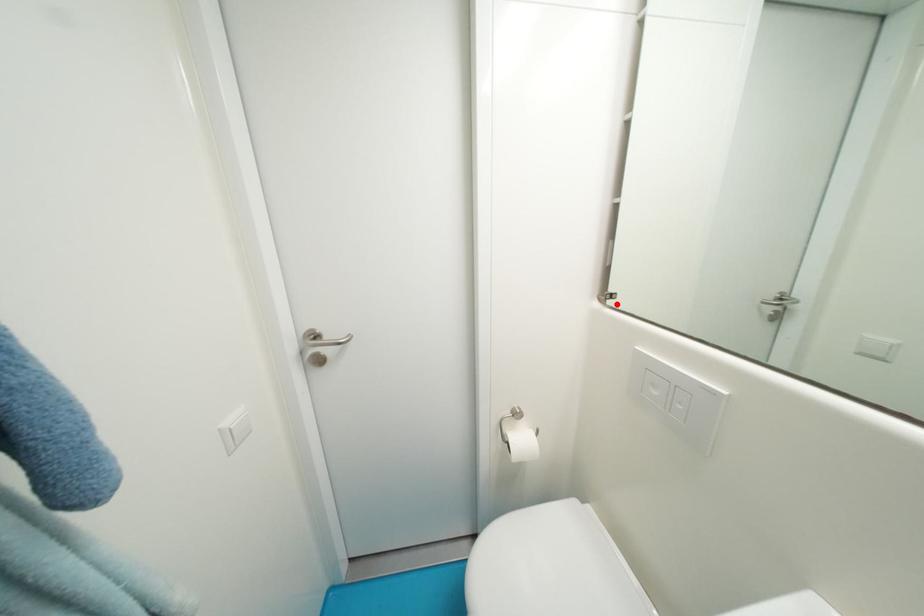
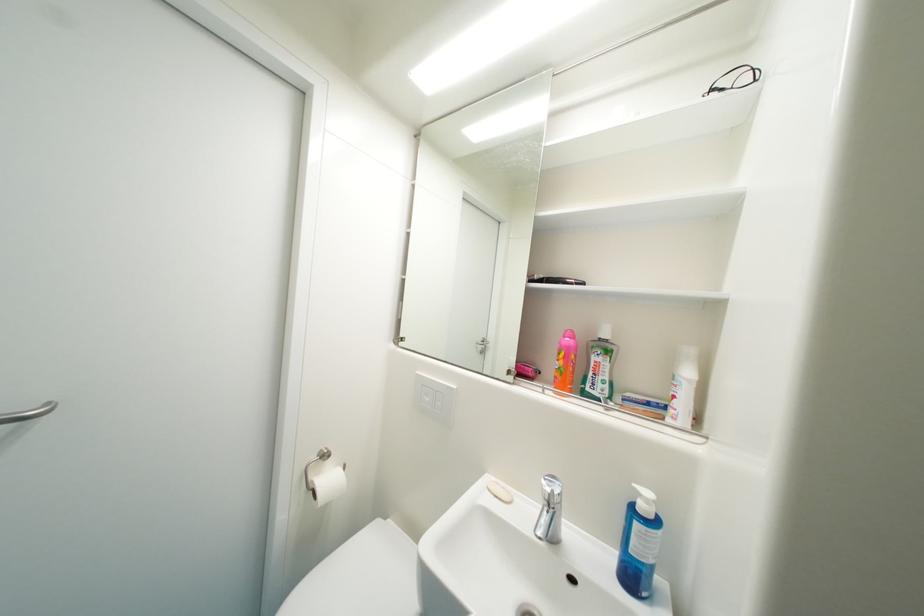
Find the pixel in the second image that matches the highlighted location in the first image.

(407, 345)